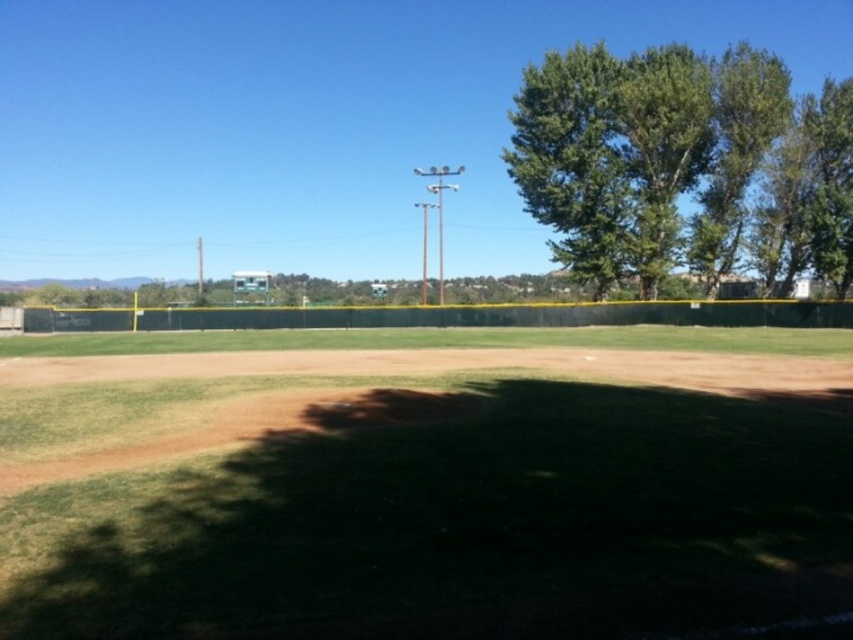
Question: Does green grass at center come in front of green leafy tree at upper right?

Choices:
 (A) yes
 (B) no

Answer: (A)

Question: Can you confirm if green grass at center is positioned below green leafy tree at upper right?

Choices:
 (A) yes
 (B) no

Answer: (A)

Question: Is green grass at center positioned before green leafy tree at upper right?

Choices:
 (A) no
 (B) yes

Answer: (B)

Question: Which object is farther from the camera taking this photo?

Choices:
 (A) green leafy tree at upper right
 (B) green grass at center

Answer: (A)

Question: Which point is farther to the camera?

Choices:
 (A) green grass at center
 (B) green leafy tree at upper right

Answer: (B)